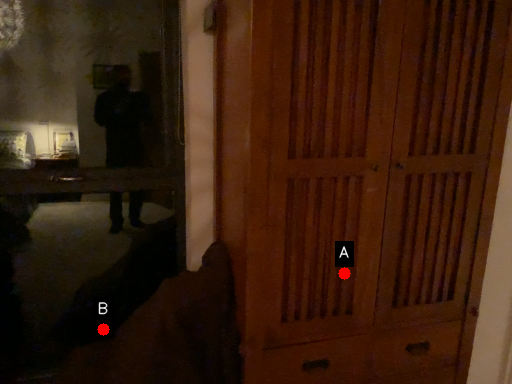
Question: Two points are circled on the image, labeled by A and B beside each circle. Which point is further to the camera?

Choices:
 (A) A is further
 (B) B is further

Answer: (B)